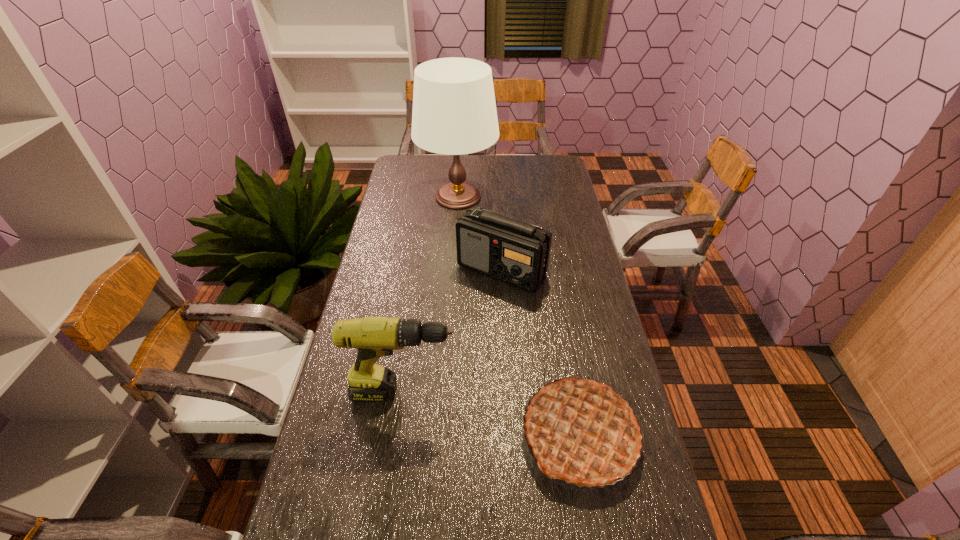
At what (x,y) coordinates should I click in order to perform the action: click on lamp that is at the left edge. Please return your answer as a coordinate pair (x, y). Image resolution: width=960 pixels, height=540 pixels. Looking at the image, I should click on (x=454, y=112).

This screenshot has width=960, height=540. I want to click on drill that is at the left edge, so click(374, 337).

This screenshot has width=960, height=540. In order to click on object present at the right edge in this screenshot , I will do `click(581, 431)`.

Where is `object that is at the far left corner`? This screenshot has height=540, width=960. object that is at the far left corner is located at coordinates (454, 112).

The width and height of the screenshot is (960, 540). In the image, there is a desktop. What are the coordinates of `vacant space at the left edge` in the screenshot? It's located at (x=396, y=195).

In order to click on free region at the right edge of the desktop in this screenshot , I will do `click(589, 341)`.

Where is `vacant point at the far left corner`? vacant point at the far left corner is located at coordinates (400, 176).

Locate an element on the screen. The image size is (960, 540). free space at the far right corner of the desktop is located at coordinates (539, 157).

Identify the location of vacant area that lies between the drill and the pie. This screenshot has height=540, width=960. (492, 414).

What are the coordinates of `free space between the pie and the second farthest object` in the screenshot? It's located at (540, 353).